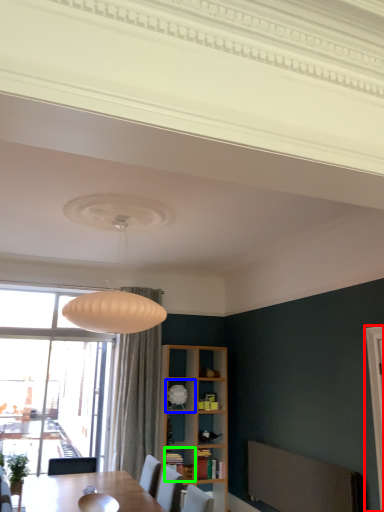
Question: Which is farther away from screen door (highlighted by a red box)? shelf (highlighted by a blue box) or shelf (highlighted by a green box)?

Choices:
 (A) shelf
 (B) shelf

Answer: (A)